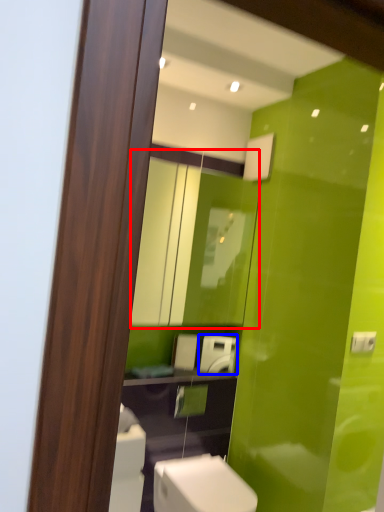
Question: Which object appears farthest to the camera in this image, mirror (highlighted by a red box) or appliance (highlighted by a blue box)?

Choices:
 (A) mirror
 (B) appliance

Answer: (B)